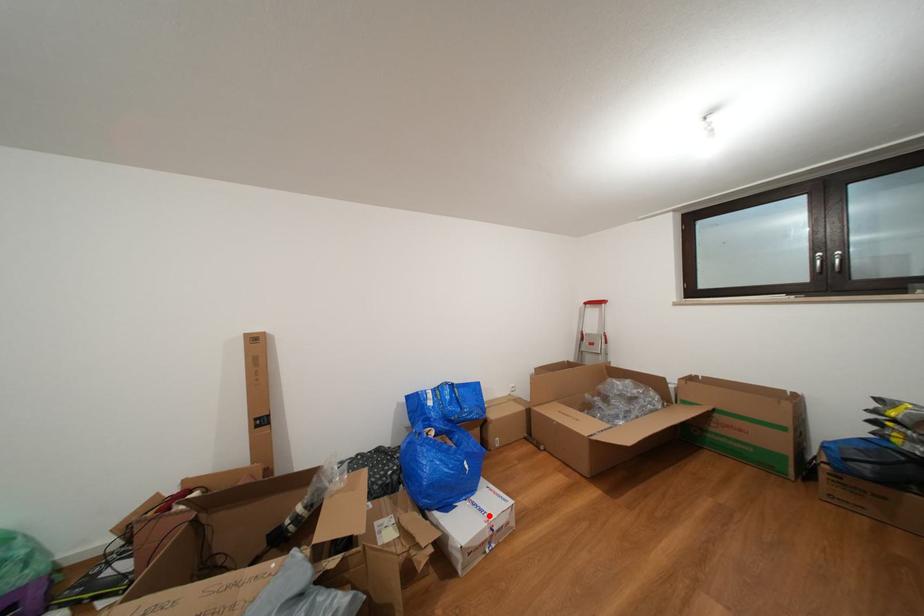
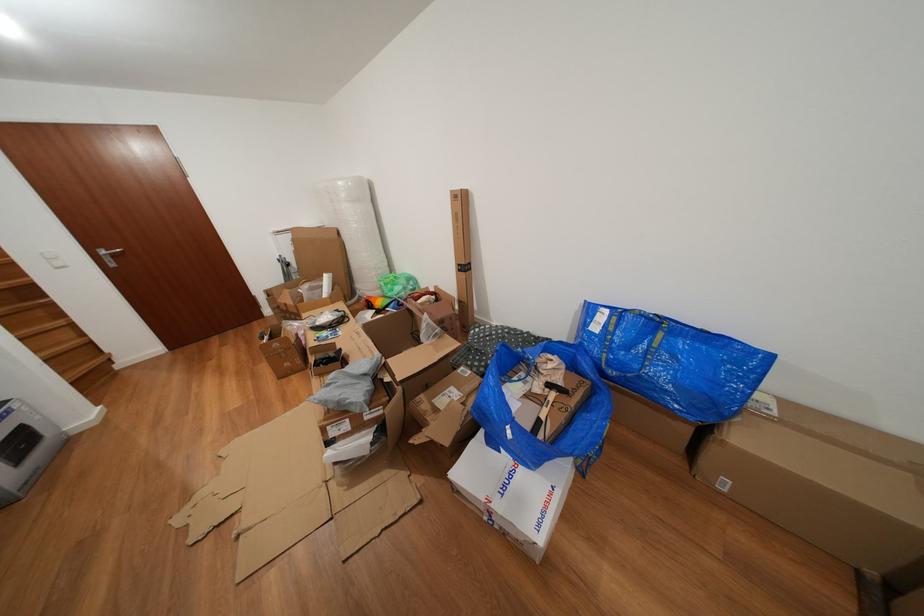
In the second image, find the point that corresponds to the highlighted location in the first image.

(513, 493)